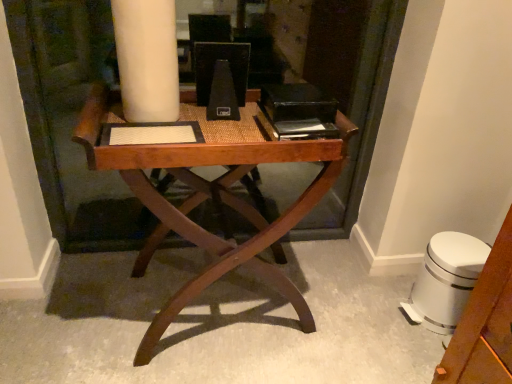
The image size is (512, 384). Identify the location of free point below wooden desk at center (from a real-world perspective). (209, 302).